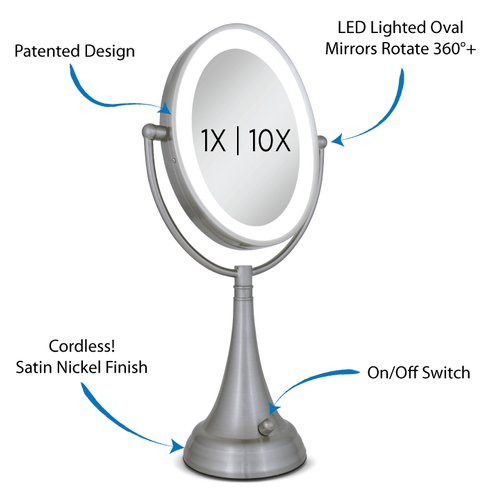
The image size is (489, 497). Identify the location of light gray mirror. (240, 229).